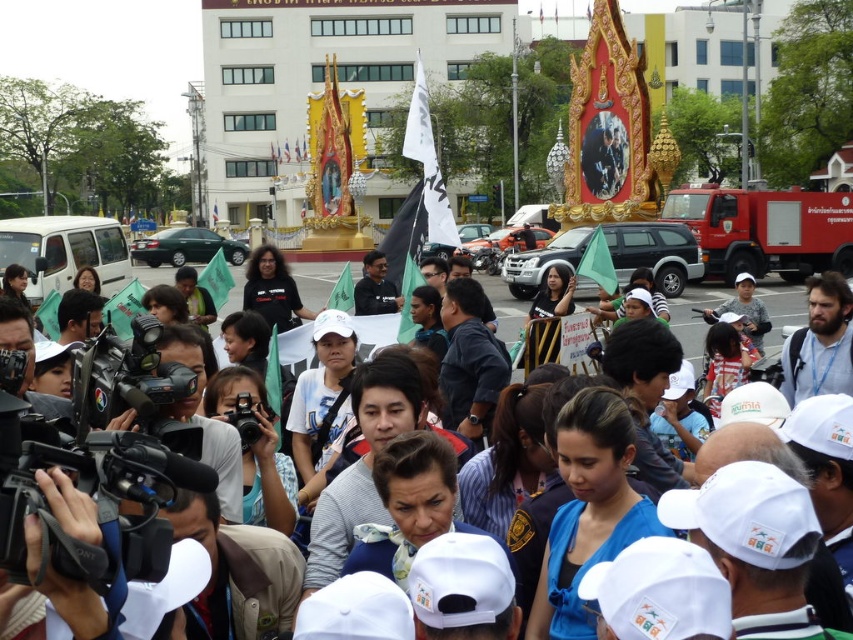
Is red matte fire truck at right taller than white fabric flag at center?

Incorrect, red matte fire truck at right's height is not larger of white fabric flag at center's.

Which is in front, point (793, 252) or point (764, 296)?

Positioned in front is point (764, 296).

Locate an element on the screen. Image resolution: width=853 pixels, height=640 pixels. red matte fire truck at right is located at coordinates (764, 230).